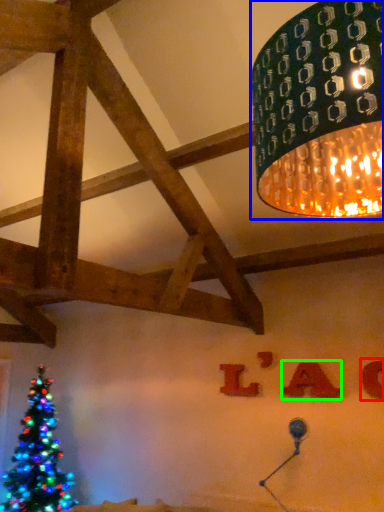
Question: Which object is positioned closest to alphabet (highlighted by a red box)? Select from lamp (highlighted by a blue box) and alphabet (highlighted by a green box).

Choices:
 (A) lamp
 (B) alphabet

Answer: (B)